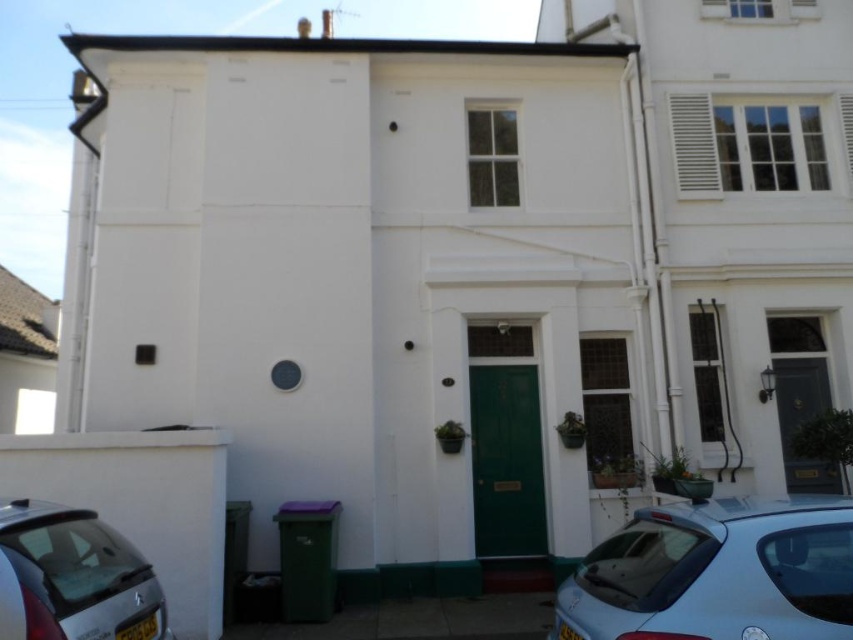
Question: Can you confirm if light blue metallic hatchback at lower right is bigger than silver metallic car at lower left?

Choices:
 (A) yes
 (B) no

Answer: (A)

Question: Is light blue metallic hatchback at lower right closer to camera compared to silver metallic car at lower left?

Choices:
 (A) yes
 (B) no

Answer: (A)

Question: Which point is farther to the camera?

Choices:
 (A) light blue metallic hatchback at lower right
 (B) silver metallic car at lower left

Answer: (B)

Question: Can you confirm if light blue metallic hatchback at lower right is positioned below silver metallic car at lower left?

Choices:
 (A) no
 (B) yes

Answer: (A)

Question: Which point is farther to the camera?

Choices:
 (A) (138, 609)
 (B) (838, 580)

Answer: (A)